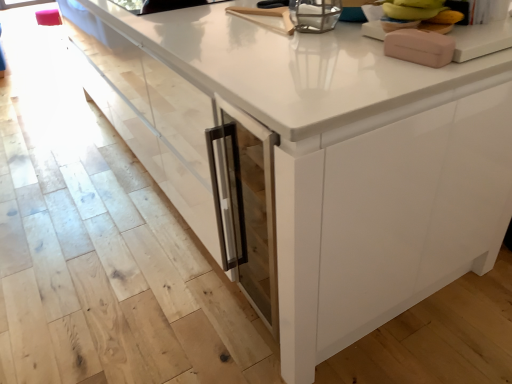
Question: Is pink matte soap dispenser at upper right, the 2th appliance from the top, completely or partially outside of yellow banana at upper right?

Choices:
 (A) no
 (B) yes

Answer: (B)

Question: Considering the relative sizes of pink matte soap dispenser at upper right, the first appliance when ordered from bottom to top, and yellow banana at upper right in the image provided, is pink matte soap dispenser at upper right, the first appliance when ordered from bottom to top, wider than yellow banana at upper right?

Choices:
 (A) yes
 (B) no

Answer: (A)

Question: Can you confirm if pink matte soap dispenser at upper right, the 2th appliance from the top, is bigger than yellow banana at upper right?

Choices:
 (A) yes
 (B) no

Answer: (B)

Question: From a real-world perspective, is pink matte soap dispenser at upper right, which is the first appliance in front-to-back order, located higher than yellow banana at upper right?

Choices:
 (A) yes
 (B) no

Answer: (B)

Question: Can you confirm if pink matte soap dispenser at upper right, the 2th appliance when ordered from back to front, is taller than yellow banana at upper right?

Choices:
 (A) yes
 (B) no

Answer: (B)

Question: From their relative heights in the image, would you say pink matte soap dispenser at upper right, acting as the second appliance starting from the left, is taller or shorter than yellow banana at upper right?

Choices:
 (A) tall
 (B) short

Answer: (B)

Question: In the image, is pink matte soap dispenser at upper right, the 2th appliance from the top, positioned in front of or behind yellow banana at upper right?

Choices:
 (A) behind
 (B) front

Answer: (B)

Question: From a real-world perspective, is pink matte soap dispenser at upper right, the first appliance when ordered from bottom to top, above or below yellow banana at upper right?

Choices:
 (A) below
 (B) above

Answer: (A)

Question: Would you say pink matte soap dispenser at upper right, the first appliance when ordered from bottom to top, is inside or outside yellow banana at upper right?

Choices:
 (A) inside
 (B) outside

Answer: (B)

Question: In terms of height, does yellow banana at upper right look taller or shorter compared to pink matte soap dispenser at upper right, which is the first appliance in front-to-back order?

Choices:
 (A) tall
 (B) short

Answer: (A)

Question: In terms of width, does yellow banana at upper right look wider or thinner when compared to pink matte soap dispenser at upper right, acting as the second appliance starting from the left?

Choices:
 (A) wide
 (B) thin

Answer: (B)

Question: Does point (411, 3) appear closer or farther from the camera than point (403, 56)?

Choices:
 (A) farther
 (B) closer

Answer: (A)

Question: Would you say yellow banana at upper right is to the left or to the right of pink matte soap dispenser at upper right, the 2th appliance from the top, in the picture?

Choices:
 (A) right
 (B) left

Answer: (A)

Question: From a real-world perspective, relative to metallic glass container at upper center, positioned as the 1th appliance in back-to-front order, is pink matte soap dispenser at upper right, acting as the second appliance starting from the left, vertically above or below?

Choices:
 (A) below
 (B) above

Answer: (A)

Question: Considering the positions of pink matte soap dispenser at upper right, which is the first appliance in front-to-back order, and metallic glass container at upper center, acting as the first appliance starting from the left, in the image, is pink matte soap dispenser at upper right, which is the first appliance in front-to-back order, wider or thinner than metallic glass container at upper center, acting as the first appliance starting from the left,?

Choices:
 (A) thin
 (B) wide

Answer: (B)